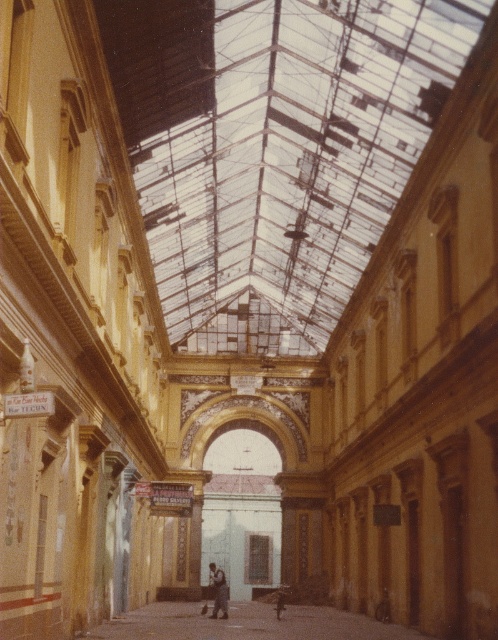
Question: Considering the relative positions of smooth concrete alley at center and dark blue jeans at center in the image provided, where is smooth concrete alley at center located with respect to dark blue jeans at center?

Choices:
 (A) right
 (B) left

Answer: (A)

Question: Among these points, which one is farthest from the camera?

Choices:
 (A) (302, 620)
 (B) (226, 616)

Answer: (A)

Question: Can you confirm if smooth concrete alley at center is positioned to the left of dark blue jeans at center?

Choices:
 (A) yes
 (B) no

Answer: (B)

Question: Which point is closer to the camera taking this photo?

Choices:
 (A) (222, 602)
 (B) (309, 611)

Answer: (A)

Question: Does smooth concrete alley at center appear on the right side of dark blue jeans at center?

Choices:
 (A) no
 (B) yes

Answer: (B)

Question: Which of the following is the closest to the observer?

Choices:
 (A) (351, 616)
 (B) (216, 605)

Answer: (B)